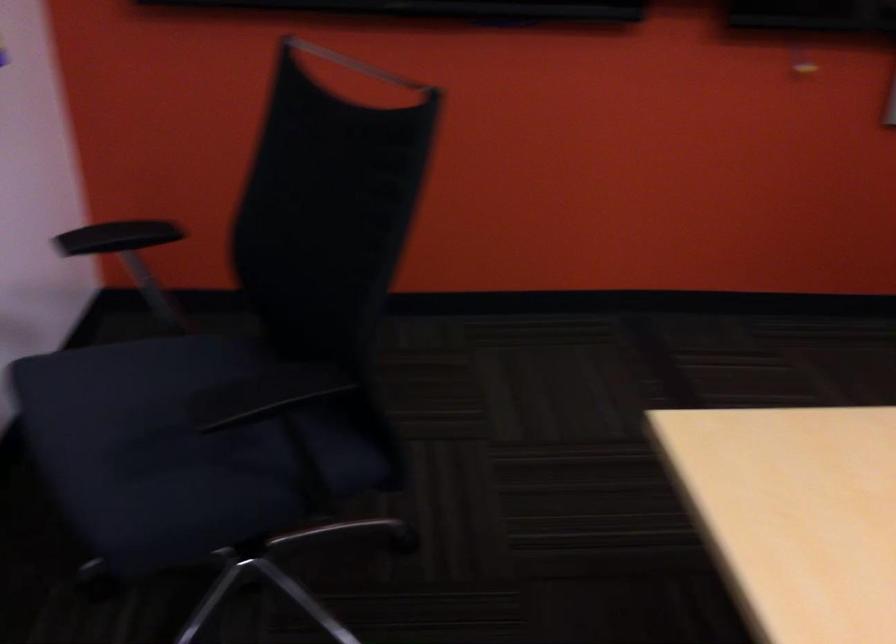
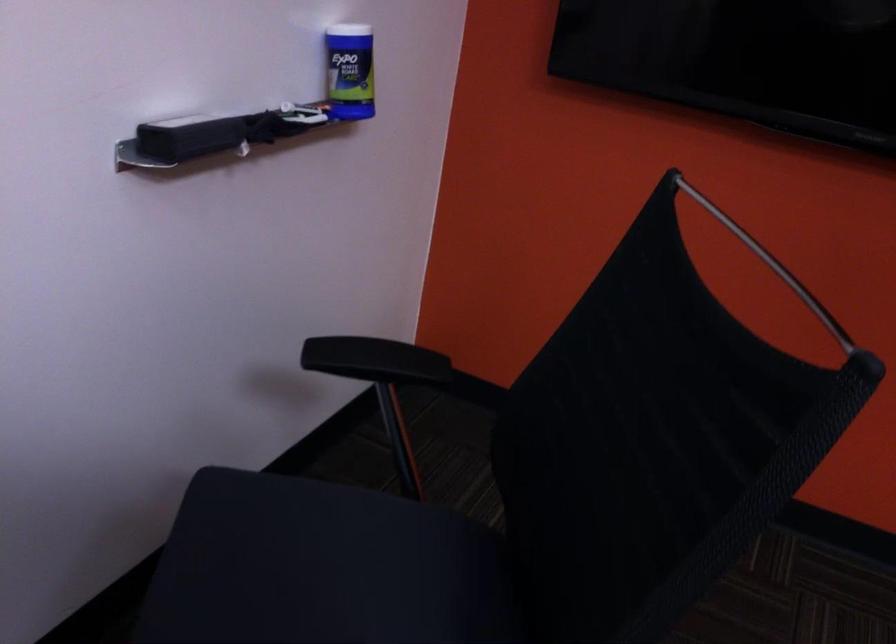
Question: How did the camera likely rotate?

Choices:
 (A) Left
 (B) Right
 (C) Up
 (D) Down

Answer: (A)